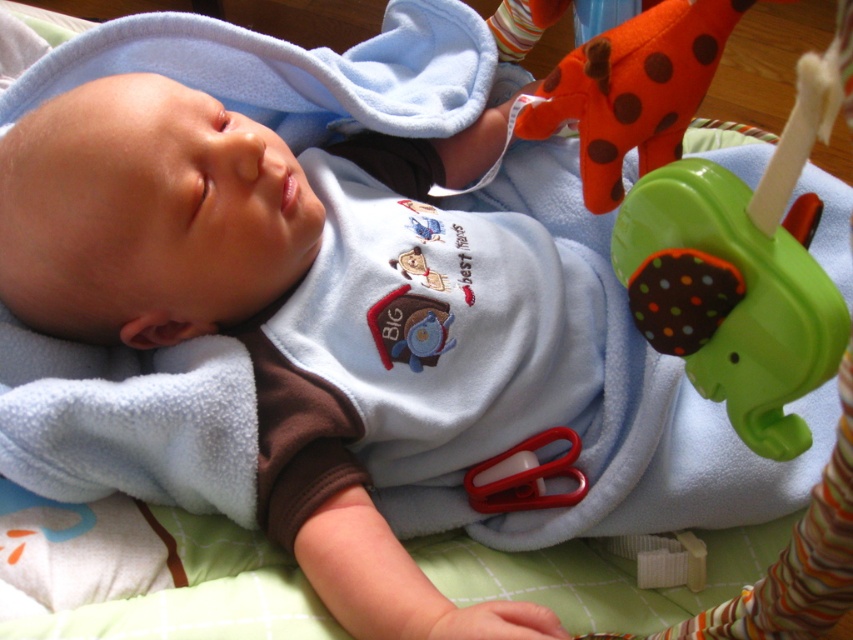
You are a parent looking at the baby lying on the blanket. Where exactly is the green plastic elephant at upper right located in the image?

The green plastic elephant at upper right is located at point 0.434 on the x axis and 0.866 on the y axis.

You are a photographer taking a picture of the baby. You notice two points in the image labeled as point [787,291] and point [654,145]. Which point should you focus on to ensure the baby is in sharp focus?

You should focus on point [787,291] because it is closer to the camera than point [654,145]. Focusing on the closer point will ensure the baby is in sharp focus.

You are a parent trying to choose a toy for your baby. You have the orange felt giraffe at upper right and the matte plastic teething ring at center. Which toy is bigger?

The orange felt giraffe at upper right is larger in size than the matte plastic teething ring at center, so the orange felt giraffe at upper right is bigger.